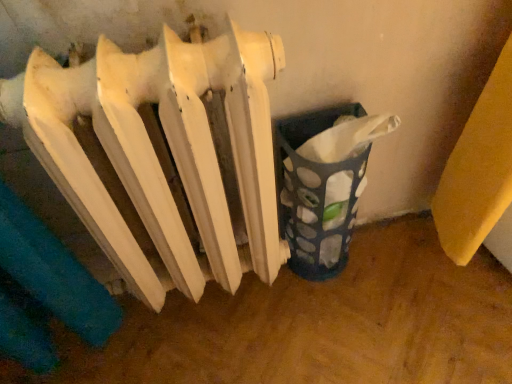
The image size is (512, 384). Describe the element at coordinates (164, 156) in the screenshot. I see `white matte radiator at center` at that location.

Identify the location of white matte radiator at center. (164, 156).

What is the approximate height of white matte radiator at center?

The height of white matte radiator at center is 64.31 centimeters.

What do you see at coordinates (319, 194) in the screenshot? The height and width of the screenshot is (384, 512). I see `translucent plastic basket at lower right` at bounding box center [319, 194].

You are a GUI agent. You are given a task and a screenshot of the screen. Output one action in this format:
    pyautogui.click(x=<x>, y=<y>)
    Task: Click on the translucent plastic basket at lower right
    The height and width of the screenshot is (384, 512).
    Given the screenshot: What is the action you would take?
    pyautogui.click(x=319, y=194)

I want to click on white matte radiator at center, so click(x=164, y=156).

Which object is positioned more to the right, white matte radiator at center or translucent plastic basket at lower right?

From the viewer's perspective, translucent plastic basket at lower right appears more on the right side.

Consider the image. Which is behind, white matte radiator at center or translucent plastic basket at lower right?

translucent plastic basket at lower right is further away from the camera.

Is point (159, 67) closer or farther from the camera than point (320, 203)?

Point (159, 67) is positioned closer to the camera compared to point (320, 203).

From the image's perspective, is white matte radiator at center located above translucent plastic basket at lower right?

No.

Looking at this image, from a real-world perspective, is white matte radiator at center above or below translucent plastic basket at lower right?

white matte radiator at center is above translucent plastic basket at lower right.

Is white matte radiator at center wider or thinner than translucent plastic basket at lower right?

Considering their sizes, white matte radiator at center looks broader than translucent plastic basket at lower right.

Considering the sizes of objects white matte radiator at center and translucent plastic basket at lower right in the image provided, who is shorter, white matte radiator at center or translucent plastic basket at lower right?

With less height is translucent plastic basket at lower right.

Is white matte radiator at center bigger than translucent plastic basket at lower right?

Yes, white matte radiator at center is bigger than translucent plastic basket at lower right.

Which is correct: white matte radiator at center is inside translucent plastic basket at lower right, or outside of it?

white matte radiator at center is outside translucent plastic basket at lower right.

Is white matte radiator at center not near translucent plastic basket at lower right?

white matte radiator at center is actually quite close to translucent plastic basket at lower right.

From the picture: Does white matte radiator at center turn towards translucent plastic basket at lower right?

No, white matte radiator at center is not facing towards translucent plastic basket at lower right.

Locate an element on the screen. The image size is (512, 384). radiator on the left of translucent plastic basket at lower right is located at coordinates (164, 156).

Considering the positions of objects translucent plastic basket at lower right and white matte radiator at center in the image provided, who is more to the right, translucent plastic basket at lower right or white matte radiator at center?

translucent plastic basket at lower right is more to the right.

Is translucent plastic basket at lower right in front of or behind white matte radiator at center in the image?

In the image, translucent plastic basket at lower right appears behind white matte radiator at center.

Considering the positions of point (309, 182) and point (91, 132), is point (309, 182) closer or farther from the camera than point (91, 132)?

Clearly, point (309, 182) is more distant from the camera than point (91, 132).

From the image's perspective, is translucent plastic basket at lower right below white matte radiator at center?

No, from the image's perspective, translucent plastic basket at lower right is not below white matte radiator at center.

From a real-world perspective, is translucent plastic basket at lower right below white matte radiator at center?

Yes, from a real-world perspective, translucent plastic basket at lower right is below white matte radiator at center.

Which of these two, translucent plastic basket at lower right or white matte radiator at center, is thinner?

translucent plastic basket at lower right.

Does translucent plastic basket at lower right have a greater height compared to white matte radiator at center?

In fact, translucent plastic basket at lower right may be shorter than white matte radiator at center.

Does translucent plastic basket at lower right have a smaller size compared to white matte radiator at center?

Correct, translucent plastic basket at lower right occupies less space than white matte radiator at center.

Is translucent plastic basket at lower right inside or outside of white matte radiator at center?

translucent plastic basket at lower right is not enclosed by white matte radiator at center.

In the scene shown: Is translucent plastic basket at lower right far from white matte radiator at center?

Actually, translucent plastic basket at lower right and white matte radiator at center are a little close together.

Does translucent plastic basket at lower right turn towards white matte radiator at center?

No, translucent plastic basket at lower right is not turned towards white matte radiator at center.

How many degrees apart are the facing directions of translucent plastic basket at lower right and white matte radiator at center?

translucent plastic basket at lower right and white matte radiator at center are facing 2.21 degrees away from each other.

How much distance is there between translucent plastic basket at lower right and white matte radiator at center?

8.03 inches.

Where is `radiator located on the left of translucent plastic basket at lower right`? radiator located on the left of translucent plastic basket at lower right is located at coordinates (164, 156).

I want to click on waste container below the white matte radiator at center (from a real-world perspective), so click(x=319, y=194).

You are a GUI agent. You are given a task and a screenshot of the screen. Output one action in this format:
    pyautogui.click(x=<x>, y=<y>)
    Task: Click on the radiator on the left of translucent plastic basket at lower right
    
    Given the screenshot: What is the action you would take?
    pyautogui.click(x=164, y=156)